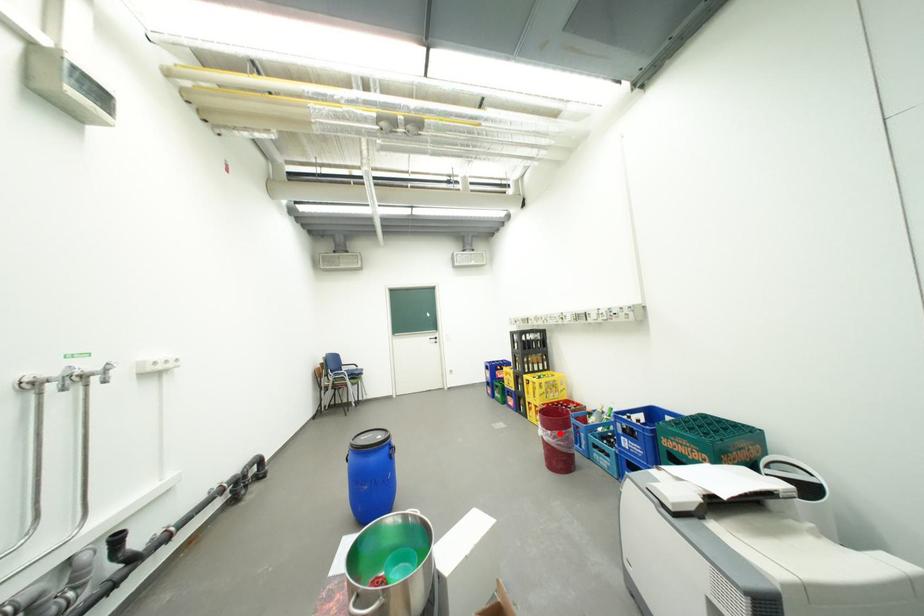
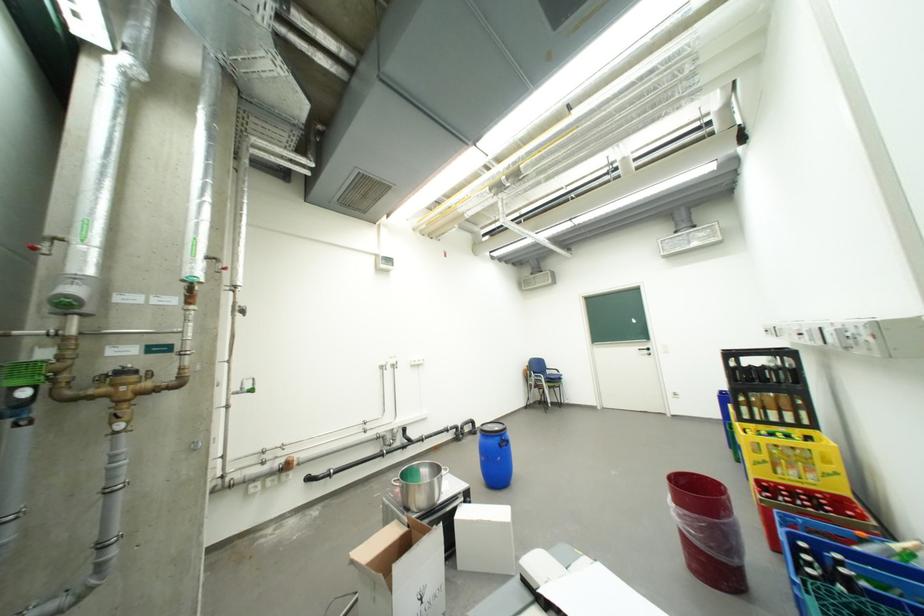
Question: I am providing you with two images of the same scene from different viewpoints. Given a red point in image1, look at the same physical point in image2. Is it:

Choices:
 (A) Closer to the viewpoint
 (B) Farther from the viewpoint

Answer: (A)